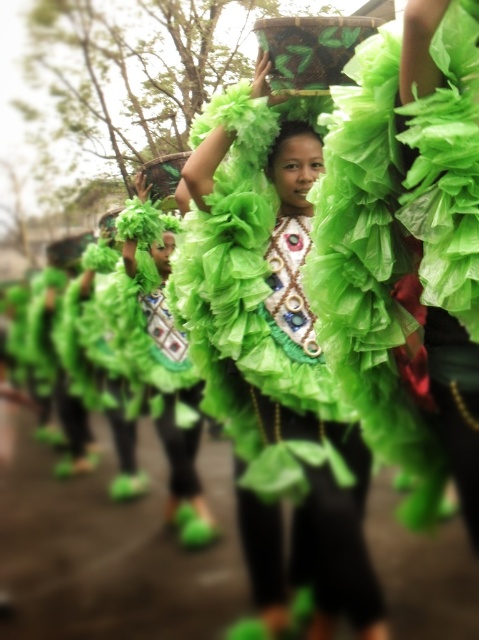
You are a photographer at the event and want to capture a photo of both the green fabric dress at center and the ruffled green dress at center. Which one should you focus on first if you want to include both in the frame without moving the camera?

You should focus on the ruffled green dress at center first because the green fabric dress at center is to the right of it, so by centering the ruffled one, you can include both in the frame without moving the camera.

Based on the photo, you are a photographer standing in front of the performers. You want to take a photo that focuses on the green fabric dress at center and the ruffled green dress at center. Which dress will appear larger in the photo?

The green fabric dress at center will appear larger in the photo because it is closer to the viewer than the ruffled green dress at center.

You are a photographer trying to capture the green fabric dress at center. Based on the scene description, where should you position your camera to ensure the dress is in the center of your photo?

The green fabric dress at center is located at point (271, 346), so you should position your camera to aim directly at those coordinates to center the dress in your photo.